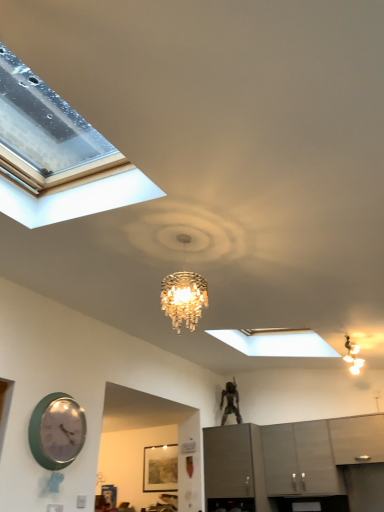
Question: Does satin gray cabinets at lower right, positioned as the second cabinetry in left-to-right order, have a larger size compared to wooden textured picture frame at center?

Choices:
 (A) yes
 (B) no

Answer: (A)

Question: Is satin gray cabinets at lower right, positioned as the 2th cabinetry in right-to-left order, not close to wooden textured picture frame at center?

Choices:
 (A) yes
 (B) no

Answer: (A)

Question: Can you confirm if satin gray cabinets at lower right, positioned as the 2th cabinetry in right-to-left order, is smaller than wooden textured picture frame at center?

Choices:
 (A) no
 (B) yes

Answer: (A)

Question: Is satin gray cabinets at lower right, positioned as the 2th cabinetry in right-to-left order, taller than wooden textured picture frame at center?

Choices:
 (A) yes
 (B) no

Answer: (A)

Question: Is satin gray cabinets at lower right, positioned as the 2th cabinetry in right-to-left order, at the right side of wooden textured picture frame at center?

Choices:
 (A) no
 (B) yes

Answer: (B)

Question: In terms of width, does green glossy wall clock at lower left look wider or thinner when compared to satin gray cabinets at lower right, positioned as the second cabinetry in left-to-right order?

Choices:
 (A) wide
 (B) thin

Answer: (B)

Question: From their relative heights in the image, would you say green glossy wall clock at lower left is taller or shorter than satin gray cabinets at lower right, positioned as the 2th cabinetry in right-to-left order?

Choices:
 (A) tall
 (B) short

Answer: (B)

Question: From the image's perspective, is green glossy wall clock at lower left located above or below satin gray cabinets at lower right, positioned as the second cabinetry in left-to-right order?

Choices:
 (A) below
 (B) above

Answer: (B)

Question: Would you say green glossy wall clock at lower left is inside or outside satin gray cabinets at lower right, positioned as the second cabinetry in left-to-right order?

Choices:
 (A) inside
 (B) outside

Answer: (B)

Question: Considering the positions of point (352, 425) and point (51, 444), is point (352, 425) closer or farther from the camera than point (51, 444)?

Choices:
 (A) closer
 (B) farther

Answer: (B)

Question: Considering their positions, is matte gray cabinet at lower right, the 1th cabinetry viewed from the right, located in front of or behind green glossy wall clock at lower left?

Choices:
 (A) front
 (B) behind

Answer: (B)

Question: In terms of width, does matte gray cabinet at lower right, the 3th cabinetry from the left, look wider or thinner when compared to green glossy wall clock at lower left?

Choices:
 (A) wide
 (B) thin

Answer: (A)

Question: From the image's perspective, relative to green glossy wall clock at lower left, is matte gray cabinet at lower right, the 1th cabinetry viewed from the right, above or below?

Choices:
 (A) below
 (B) above

Answer: (A)

Question: Visually, is matte gray cabinet at center, placed as the 3th cabinetry when sorted from right to left, positioned to the left or to the right of wooden textured picture frame at center?

Choices:
 (A) right
 (B) left

Answer: (A)

Question: Considering the positions of point (226, 433) and point (157, 456), is point (226, 433) closer or farther from the camera than point (157, 456)?

Choices:
 (A) closer
 (B) farther

Answer: (A)